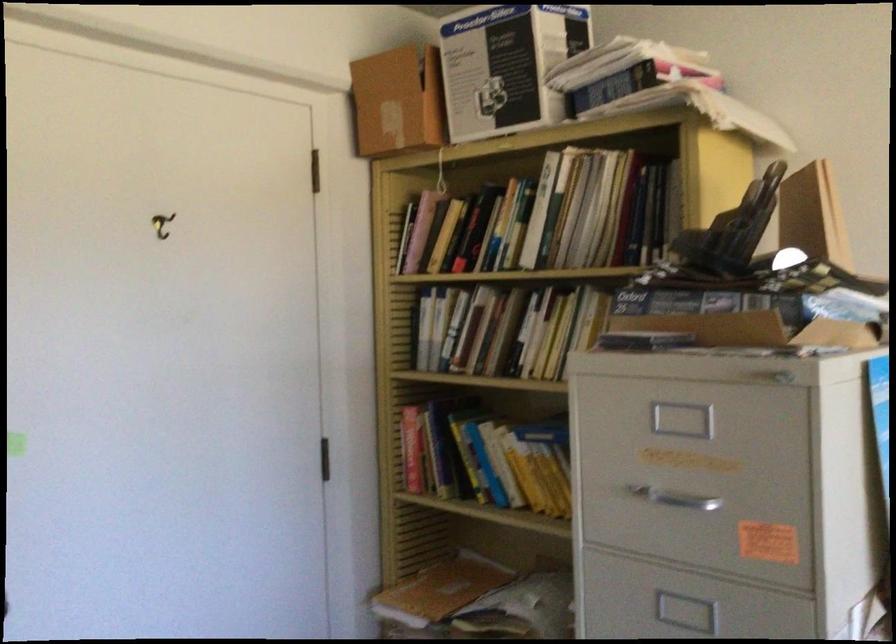
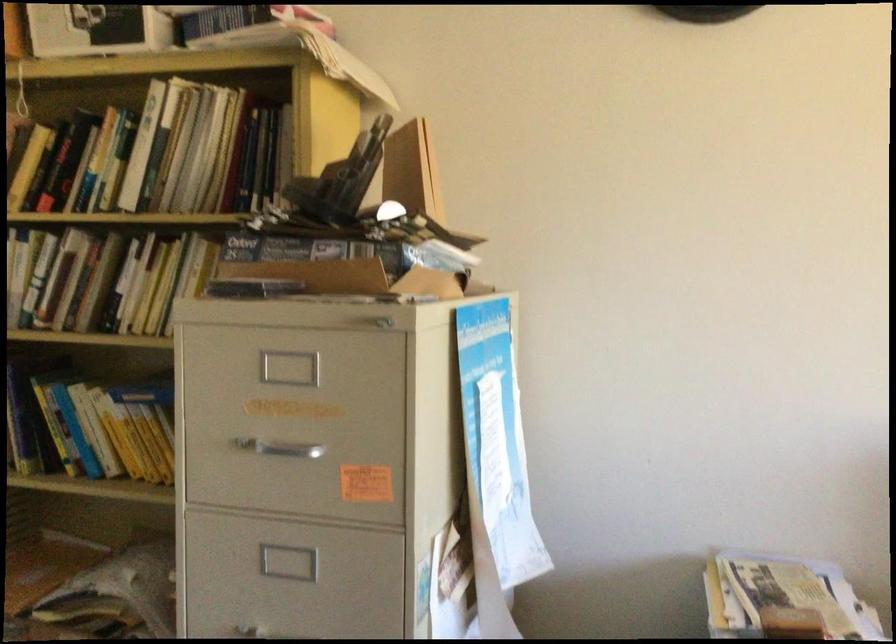
Question: The camera is either moving clockwise (left) or counter-clockwise (right) around the object. The first image is from the beginning of the video and the second image is from the end. Is the camera moving left or right when shooting the video?

Choices:
 (A) Left
 (B) Right

Answer: (A)